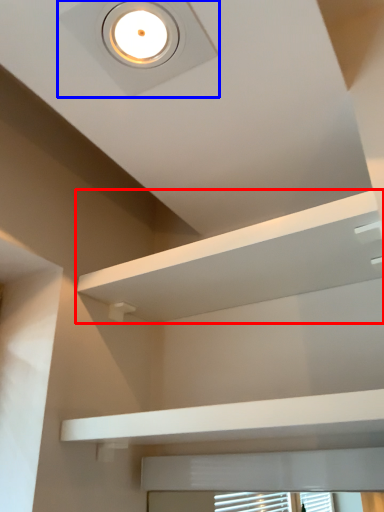
Question: Which object is further to the camera taking this photo, shelf (highlighted by a red box) or droplight (highlighted by a blue box)?

Choices:
 (A) shelf
 (B) droplight

Answer: (A)